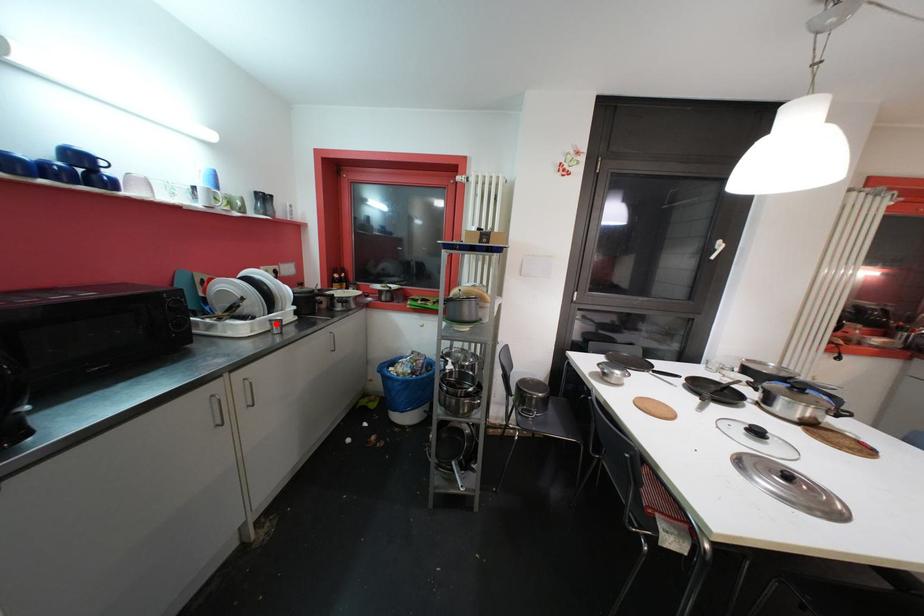
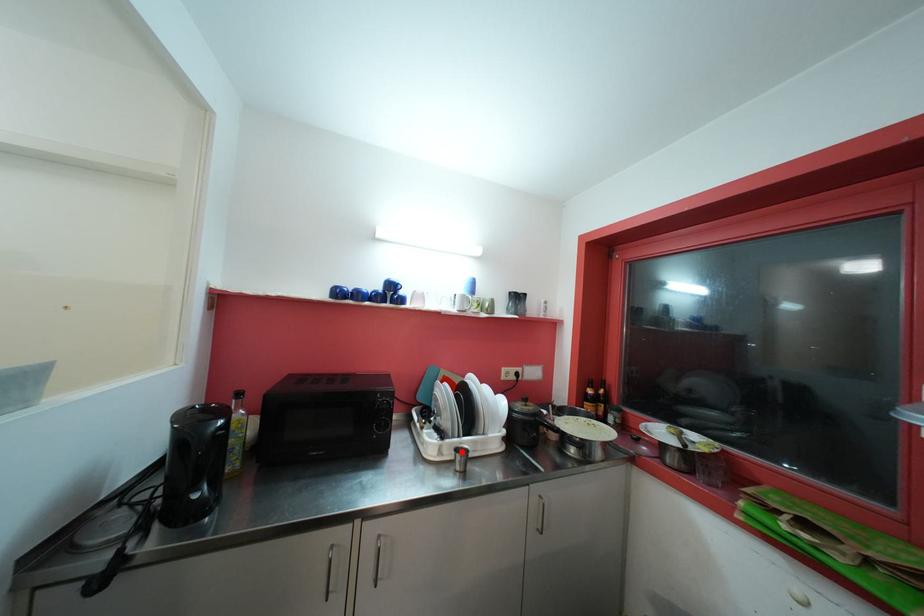
I am providing you with two images of the same scene from different viewpoints. A red point is marked on the first image and another point is marked on the second image. Is the marked point in image1 the same physical position as the marked point in image2?

Yes